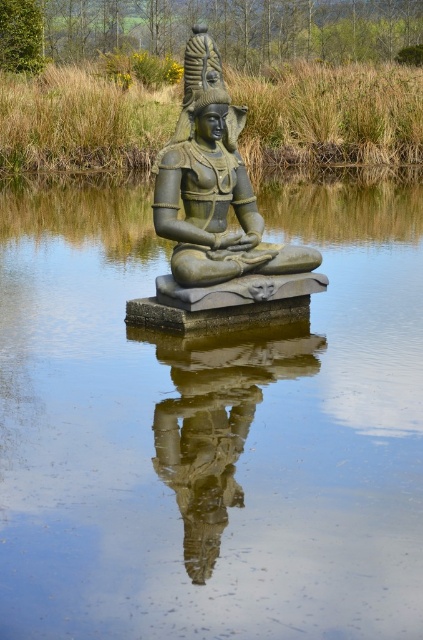
You are a photographer planning to capture the reflection of the green stone statue at center and the reflective stone statue at center in the water. Which one should you focus on to ensure you capture the actual statue and its reflection?

The green stone statue at center is located above the reflective stone statue at center, so the photographer should focus on the green stone statue at center to capture the actual statue and its reflection.

You are standing at the edge of the scene and want to take a photo of the transparent glass water at center. What are the coordinates where you should aim your camera to capture it perfectly?

The transparent glass water at center is located at coordinates point [209,426], so you should aim your camera at those coordinates to capture it perfectly.

Based on the photo, you are standing on the edge of the water and see the point marked at coordinate [214,212]. Is this point located on the green stone statue at center?

Yes, the point marked at coordinate [214,212] is located on the green stone statue at center according to the description.